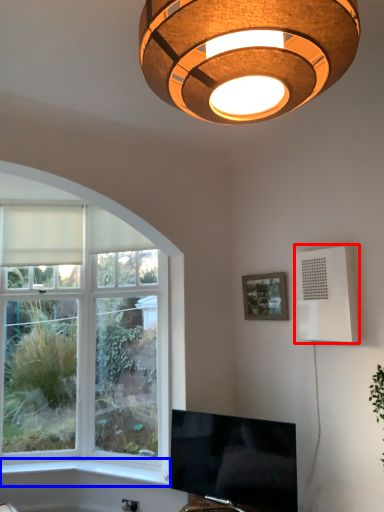
Question: Among these objects, which one is farthest to the camera, air conditioning (highlighted by a red box) or window sill (highlighted by a blue box)?

Choices:
 (A) air conditioning
 (B) window sill

Answer: (B)